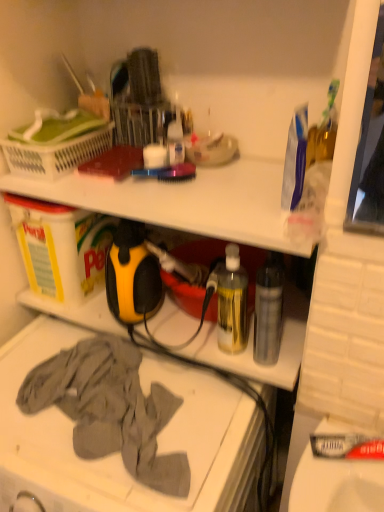
Question: Considering the relative sizes of transparent plastic bottle at center-right, acting as the 1th bottle starting from the right, and gray cotton cloth at lower left in the image provided, is transparent plastic bottle at center-right, acting as the 1th bottle starting from the right, bigger than gray cotton cloth at lower left?

Choices:
 (A) no
 (B) yes

Answer: (A)

Question: From a real-world perspective, is transparent plastic bottle at center-right, acting as the 1th bottle starting from the right, below gray cotton cloth at lower left?

Choices:
 (A) no
 (B) yes

Answer: (A)

Question: Is transparent plastic bottle at center-right, acting as the 1th bottle starting from the right, to the left of gray cotton cloth at lower left from the viewer's perspective?

Choices:
 (A) no
 (B) yes

Answer: (A)

Question: Considering the relative positions of transparent plastic bottle at center-right, acting as the 1th bottle starting from the right, and gray cotton cloth at lower left in the image provided, is transparent plastic bottle at center-right, acting as the 1th bottle starting from the right, in front of gray cotton cloth at lower left?

Choices:
 (A) yes
 (B) no

Answer: (B)

Question: Could gray cotton cloth at lower left be considered to be inside transparent plastic bottle at center-right, acting as the 1th bottle starting from the right?

Choices:
 (A) no
 (B) yes

Answer: (A)

Question: Considering the positions of gray cotton cloth at lower left and white plastic laundry basket at upper left in the image, is gray cotton cloth at lower left bigger or smaller than white plastic laundry basket at upper left?

Choices:
 (A) small
 (B) big

Answer: (B)

Question: From their relative heights in the image, would you say gray cotton cloth at lower left is taller or shorter than white plastic laundry basket at upper left?

Choices:
 (A) tall
 (B) short

Answer: (A)

Question: From a real-world perspective, is gray cotton cloth at lower left positioned above or below white plastic laundry basket at upper left?

Choices:
 (A) below
 (B) above

Answer: (A)

Question: From the image's perspective, relative to white plastic laundry basket at upper left, is gray cotton cloth at lower left above or below?

Choices:
 (A) below
 (B) above

Answer: (A)

Question: Visually, is transparent plastic bottle at center-right, acting as the 1th bottle starting from the right, positioned to the left or to the right of gray cotton cloth at lower left?

Choices:
 (A) right
 (B) left

Answer: (A)

Question: Based on their sizes in the image, would you say transparent plastic bottle at center-right, acting as the 1th bottle starting from the right, is bigger or smaller than gray cotton cloth at lower left?

Choices:
 (A) small
 (B) big

Answer: (A)

Question: Is transparent plastic bottle at center-right, which ranks as the 2th bottle in left-to-right order, in front of or behind gray cotton cloth at lower left in the image?

Choices:
 (A) behind
 (B) front

Answer: (A)

Question: From the image's perspective, is transparent plastic bottle at center-right, which ranks as the 2th bottle in left-to-right order, located above or below gray cotton cloth at lower left?

Choices:
 (A) above
 (B) below

Answer: (A)

Question: From the image's perspective, relative to gray cotton cloth at lower left, is white plastic laundry basket at upper left above or below?

Choices:
 (A) above
 (B) below

Answer: (A)

Question: Is white plastic laundry basket at upper left in front of or behind gray cotton cloth at lower left in the image?

Choices:
 (A) behind
 (B) front

Answer: (A)